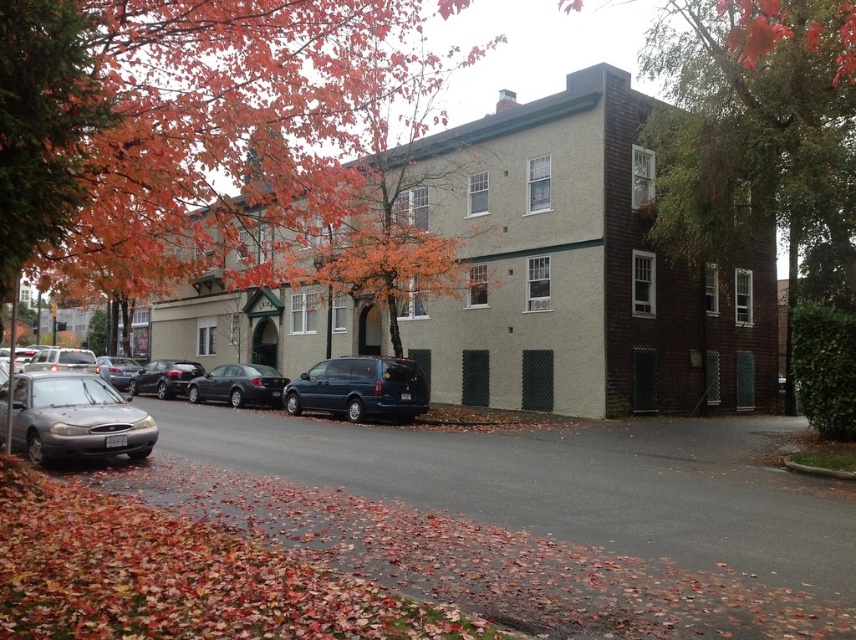
Can you confirm if satin silver sedan at left is thinner than silver metallic sedan at center-left?

Correct, satin silver sedan at left's width is less than silver metallic sedan at center-left's.

Is point (96, 380) more distant than point (111, 372)?

No, it is in front of (111, 372).

Does point (70, 416) come in front of point (122, 388)?

That is True.

Locate an element on the screen. satin silver sedan at left is located at coordinates (76, 419).

Can you confirm if satin silver sedan at center is positioned to the right of silver metallic sedan at center-left?

Correct, you'll find satin silver sedan at center to the right of silver metallic sedan at center-left.

Where is `satin silver sedan at center`? Image resolution: width=856 pixels, height=640 pixels. satin silver sedan at center is located at coordinates (70, 417).

Between shiny black sedan at center and silver metallic sedan at center-left, which one is positioned lower?

shiny black sedan at center is below.

Who is more distant from viewer, (167, 365) or (120, 362)?

Point (120, 362)

Does point (169, 372) come farther from viewer compared to point (107, 374)?

No.

I want to click on shiny black sedan at center, so click(164, 378).